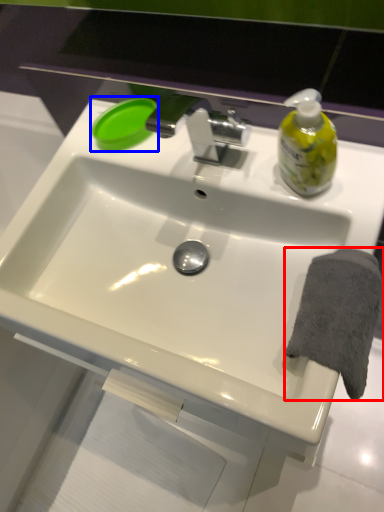
Question: Which object appears farthest to the camera in this image, bath towel (highlighted by a red box) or soap (highlighted by a blue box)?

Choices:
 (A) bath towel
 (B) soap

Answer: (B)